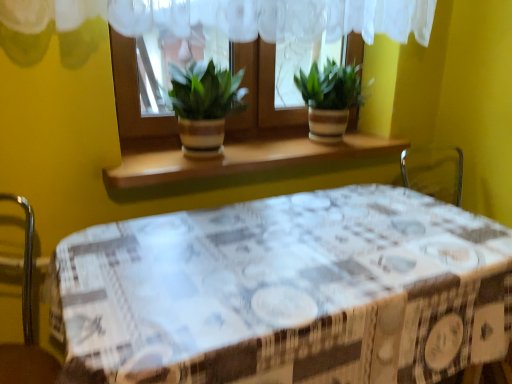
Where is `free area below green striped pot at center, which is the second houseplant in left-to-right order (from a real-world perspective)`? free area below green striped pot at center, which is the second houseplant in left-to-right order (from a real-world perspective) is located at coordinates (325, 143).